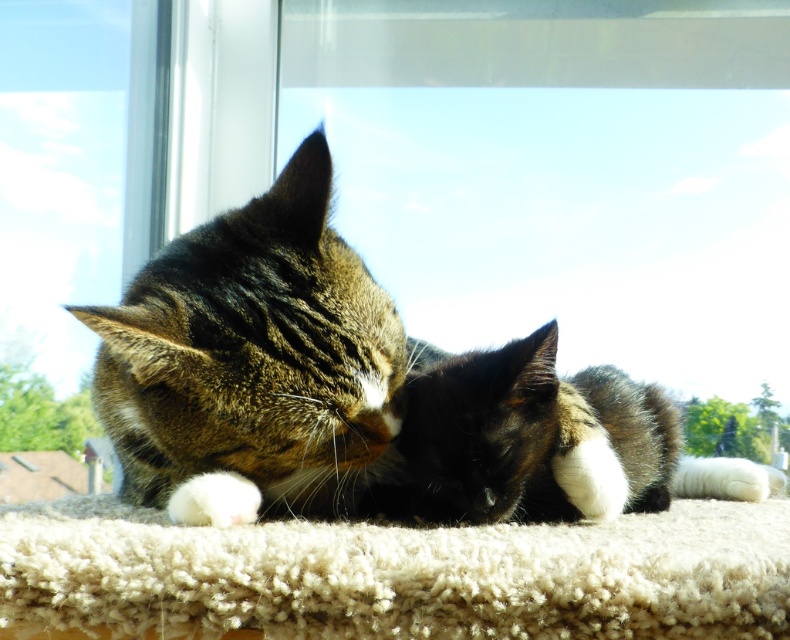
From the picture: You are a cat owner who wants to place a small blanket between the tabby fur cat at center and the black fur at center. Since the cats are resting, you need to ensure the blanket won

The tabby fur cat at center is bigger than the black fur at center, so the blanket should be placed between them in a way that accommodates the larger size of the tabby fur cat at center to avoid disturbing either cat.

You are a cat owner trying to locate your two cats in the image. The cats are positioned at coordinates point [179,461] and point [273,541]. Which cat is closer to the front of the image?

Point [273,541] is closer to the front of the image because point [179,461] is behind it.